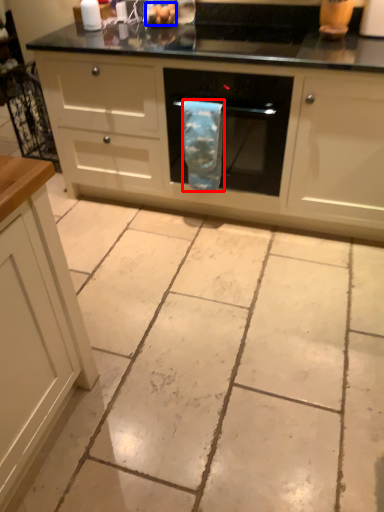
Question: Which point is closer to the camera, material (highlighted by a red box) or food (highlighted by a blue box)?

Choices:
 (A) material
 (B) food

Answer: (A)